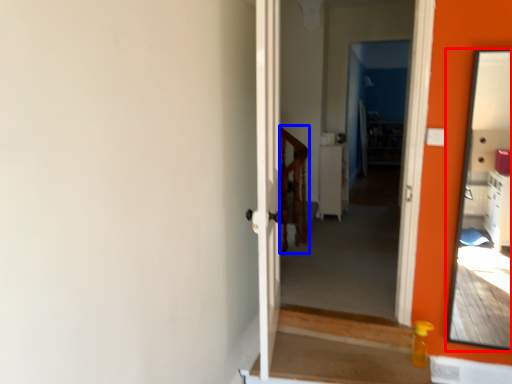
Question: Which object is closer to the camera taking this photo, mirror (highlighted by a red box) or balustrade (highlighted by a blue box)?

Choices:
 (A) mirror
 (B) balustrade

Answer: (A)